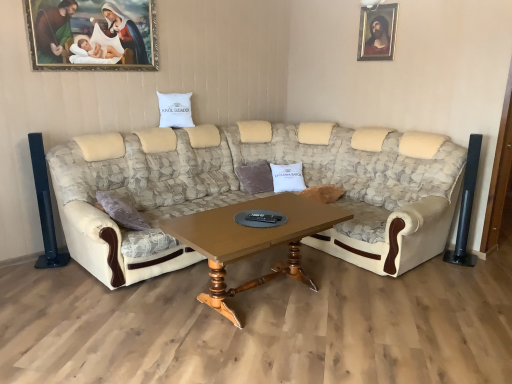
Locate an element on the screen. vacant area that is in front of wooden polished table at center is located at coordinates (282, 354).